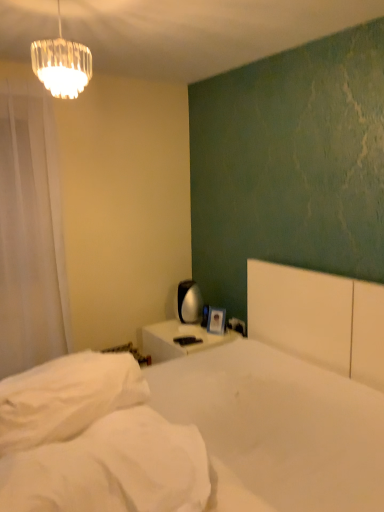
Question: Considering the positions of white matte bed at center and white soft pillow at lower left in the image, is white matte bed at center bigger or smaller than white soft pillow at lower left?

Choices:
 (A) small
 (B) big

Answer: (B)

Question: Considering the positions of point (362, 404) and point (6, 408), is point (362, 404) closer or farther from the camera than point (6, 408)?

Choices:
 (A) farther
 (B) closer

Answer: (A)

Question: Which object is the farthest from the white plastic electric outlet at upper right?

Choices:
 (A) white soft pillow at lower left
 (B) white sheer curtain at left
 (C) clear glass chandelier at upper left
 (D) white soft mattress at lower left
 (E) white matte bed at center

Answer: (C)

Question: Which object is the farthest from the white glossy nightstand at center?

Choices:
 (A) white soft mattress at lower left
 (B) white sheer curtain at left
 (C) clear glass chandelier at upper left
 (D) white soft pillow at lower left
 (E) white plastic electric outlet at upper right

Answer: (C)